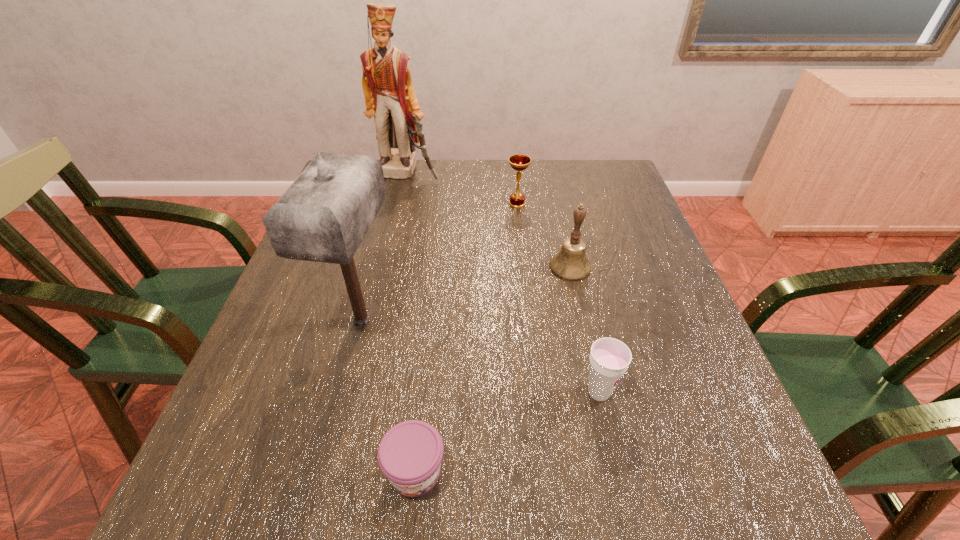
Where is `jam`? The image size is (960, 540). jam is located at coordinates (410, 453).

Find the location of a particular element. The image size is (960, 540). the shortest object is located at coordinates (410, 453).

Identify the location of free space located 0.330m on the front-facing side of the nutcracker. This screenshot has width=960, height=540. (388, 255).

Locate an element on the screen. vacant position located 0.220m on the front of the mallet is located at coordinates (321, 478).

Locate an element on the screen. free space located on the right of the third farthest object is located at coordinates (646, 267).

I want to click on free space located 0.110m on the left of the fourth object from left to right, so click(x=468, y=204).

Find the location of a particular element. The image size is (960, 540). free point located on the back of the fifth farthest object is located at coordinates pos(574,281).

Image resolution: width=960 pixels, height=540 pixels. I want to click on nutcracker that is at the far edge, so click(389, 94).

Locate an element on the screen. The width and height of the screenshot is (960, 540). chalice that is at the far edge is located at coordinates (519, 162).

Identify the location of object that is positioned at the near edge. (410, 453).